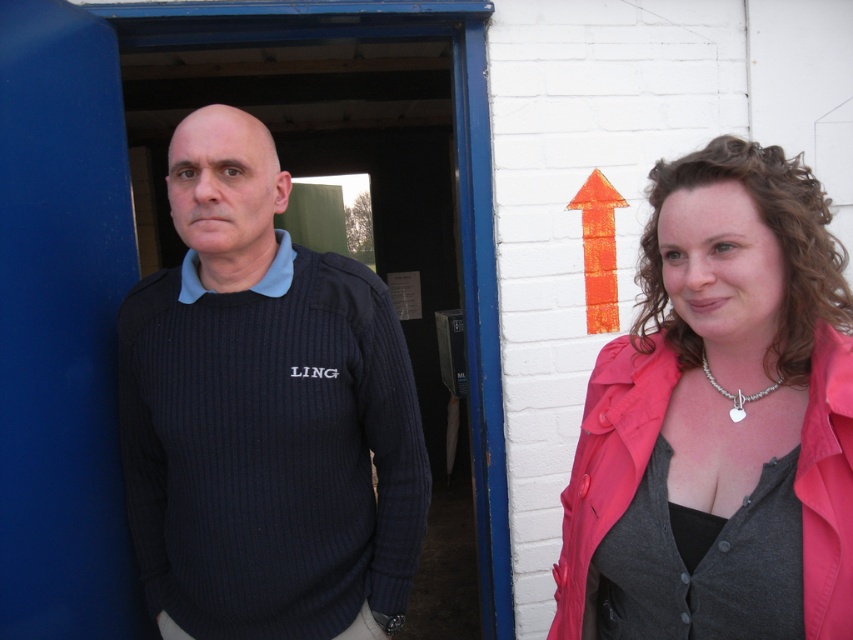
Question: Which point is closer to the camera?

Choices:
 (A) (598, 292)
 (B) (173, 182)

Answer: (B)

Question: Can you confirm if pink fabric at upper right is positioned below orange textured arrow at upper center?

Choices:
 (A) no
 (B) yes

Answer: (B)

Question: Is dark blue ribbed sweater at center wider than pink fabric at upper right?

Choices:
 (A) no
 (B) yes

Answer: (B)

Question: Among these objects, which one is nearest to the camera?

Choices:
 (A) dark blue ribbed sweater at center
 (B) orange textured arrow at upper center
 (C) pink fabric at upper right

Answer: (C)

Question: Can you confirm if dark blue ribbed sweater at center is positioned to the left of orange textured arrow at upper center?

Choices:
 (A) yes
 (B) no

Answer: (A)

Question: Which of these objects is positioned farthest from the knitted dark blue sweater at left?

Choices:
 (A) dark blue ribbed sweater at center
 (B) orange textured arrow at upper center

Answer: (B)